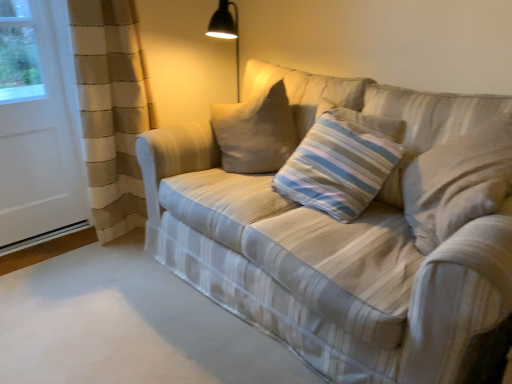
Question: Does plaid fabric couch at center have a lesser height compared to striped fabric pillow at center?

Choices:
 (A) yes
 (B) no

Answer: (B)

Question: Can you confirm if plaid fabric couch at center is positioned to the left of striped fabric pillow at center?

Choices:
 (A) yes
 (B) no

Answer: (A)

Question: Can you confirm if plaid fabric couch at center is wider than striped fabric pillow at center?

Choices:
 (A) no
 (B) yes

Answer: (B)

Question: Is plaid fabric couch at center further to the viewer compared to striped fabric pillow at center?

Choices:
 (A) yes
 (B) no

Answer: (B)

Question: Can you confirm if plaid fabric couch at center is thinner than striped fabric pillow at center?

Choices:
 (A) yes
 (B) no

Answer: (B)

Question: Looking at the image, does white matte screen door at left seem bigger or smaller compared to striped fabric pillow at center?

Choices:
 (A) big
 (B) small

Answer: (A)

Question: Is white matte screen door at left inside the boundaries of striped fabric pillow at center, or outside?

Choices:
 (A) outside
 (B) inside

Answer: (A)

Question: Would you say white matte screen door at left is to the left or to the right of striped fabric pillow at center in the picture?

Choices:
 (A) right
 (B) left

Answer: (B)

Question: In terms of width, does white matte screen door at left look wider or thinner when compared to striped fabric pillow at center?

Choices:
 (A) thin
 (B) wide

Answer: (A)

Question: Considering the positions of plaid fabric couch at center and white matte screen door at left in the image, is plaid fabric couch at center taller or shorter than white matte screen door at left?

Choices:
 (A) tall
 (B) short

Answer: (B)

Question: From the image's perspective, is plaid fabric couch at center positioned above or below white matte screen door at left?

Choices:
 (A) below
 (B) above

Answer: (A)

Question: Looking at the image, does plaid fabric couch at center seem bigger or smaller compared to white matte screen door at left?

Choices:
 (A) small
 (B) big

Answer: (B)

Question: Is plaid fabric couch at center inside or outside of white matte screen door at left?

Choices:
 (A) outside
 (B) inside

Answer: (A)

Question: Considering their positions, is striped fabric pillow at center located in front of or behind white matte screen door at left?

Choices:
 (A) behind
 (B) front

Answer: (B)

Question: Is striped fabric pillow at center taller or shorter than white matte screen door at left?

Choices:
 (A) tall
 (B) short

Answer: (B)